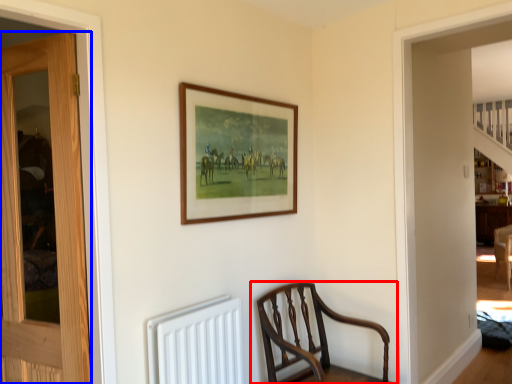
Question: Which object is further to the camera taking this photo, chair (highlighted by a red box) or door (highlighted by a blue box)?

Choices:
 (A) chair
 (B) door

Answer: (A)